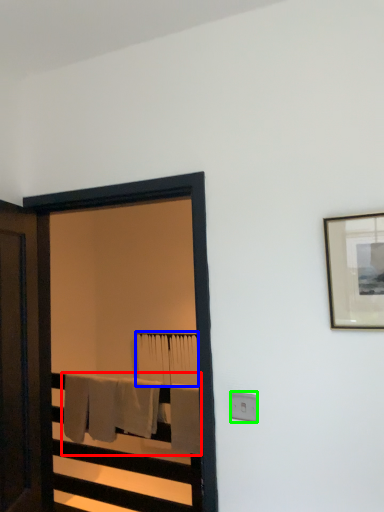
Question: Which is farther away from bath towel (highlighted by a red box)? bath towel (highlighted by a blue box) or electric outlet (highlighted by a green box)?

Choices:
 (A) bath towel
 (B) electric outlet

Answer: (B)